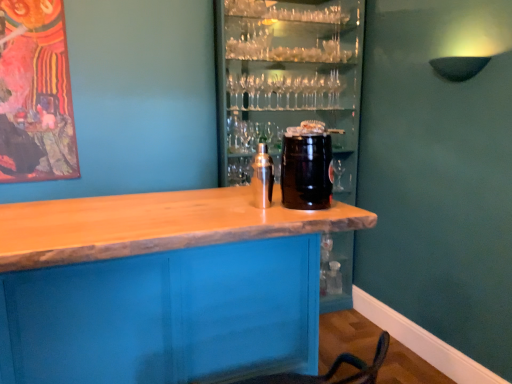
The image size is (512, 384). Identify the location of empty space that is ontop of wooden table at center. (159, 206).